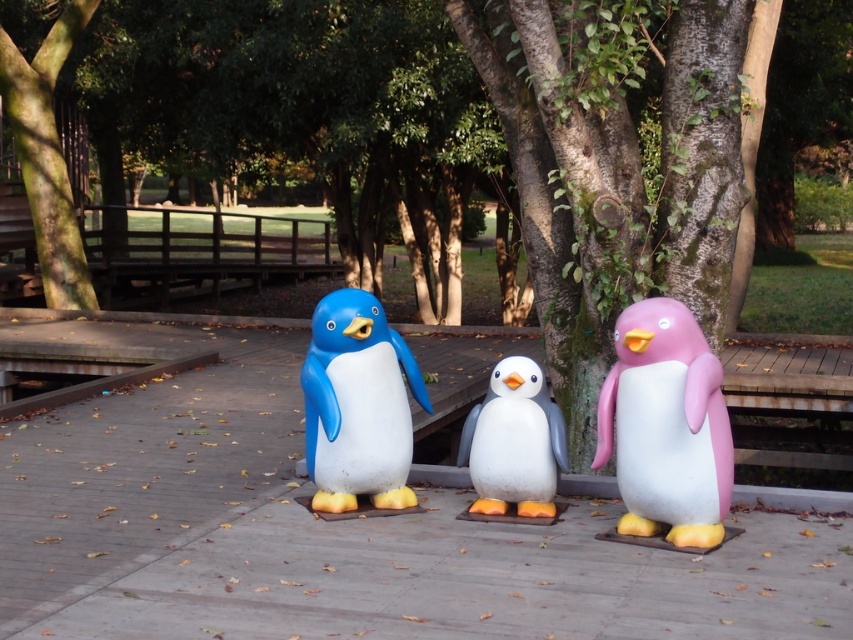
Question: Which point is closer to the camera?

Choices:
 (A) matte blue penguin at center
 (B) pink matte/painted penguin at right

Answer: (B)

Question: Can you confirm if green mossy bark tree at center is smaller than matte blue penguin at center?

Choices:
 (A) yes
 (B) no

Answer: (B)

Question: Does green mossy bark tree at center appear under white matte penguin at center?

Choices:
 (A) no
 (B) yes

Answer: (A)

Question: Does matte blue penguin at center lie behind white matte penguin at center?

Choices:
 (A) yes
 (B) no

Answer: (B)

Question: Estimate the real-world distances between objects in this image. Which object is closer to the white matte penguin at center?

Choices:
 (A) matte blue penguin at center
 (B) green rough bark tree at upper center
 (C) green mossy bark tree at center
 (D) pink matte/painted penguin at right

Answer: (A)

Question: Which point is farther to the camera?

Choices:
 (A) (10, 116)
 (B) (466, 10)
 (C) (671, 376)

Answer: (A)